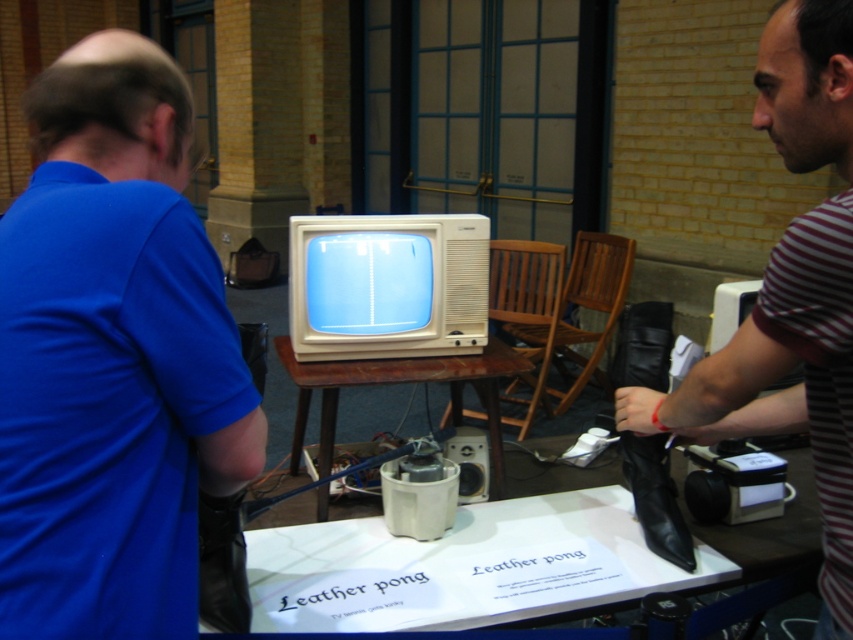
Is blue matte shirt at left thinner than white paper at center?

Yes, blue matte shirt at left is thinner than white paper at center.

Between blue matte shirt at left and white paper at center, which one appears on the left side from the viewer's perspective?

Positioned to the left is blue matte shirt at left.

Which is in front, point (35, 104) or point (416, 552)?

Point (35, 104)

The height and width of the screenshot is (640, 853). I want to click on blue matte shirt at left, so click(112, 356).

This screenshot has height=640, width=853. Find the location of `blue matte shirt at left`. blue matte shirt at left is located at coordinates 112,356.

Does blue matte shirt at left have a smaller size compared to striped cotton shirt at right?

Yes, blue matte shirt at left is smaller than striped cotton shirt at right.

Where is `blue matte shirt at left`? blue matte shirt at left is located at coordinates (112, 356).

Locate an element on the screen. The image size is (853, 640). striped cotton shirt at right is located at coordinates (791, 294).